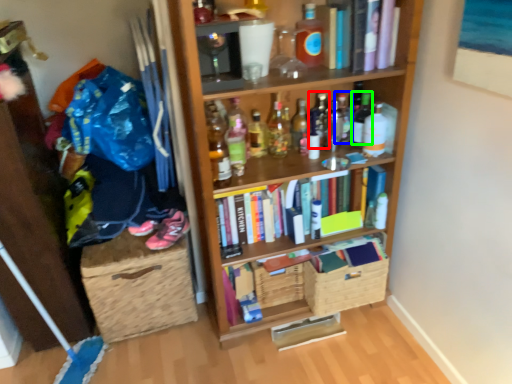
Question: Estimate the real-world distances between objects in this image. Which object is farther from bottle (highlighted by a red box), bottle (highlighted by a blue box) or bottle (highlighted by a green box)?

Choices:
 (A) bottle
 (B) bottle

Answer: (B)